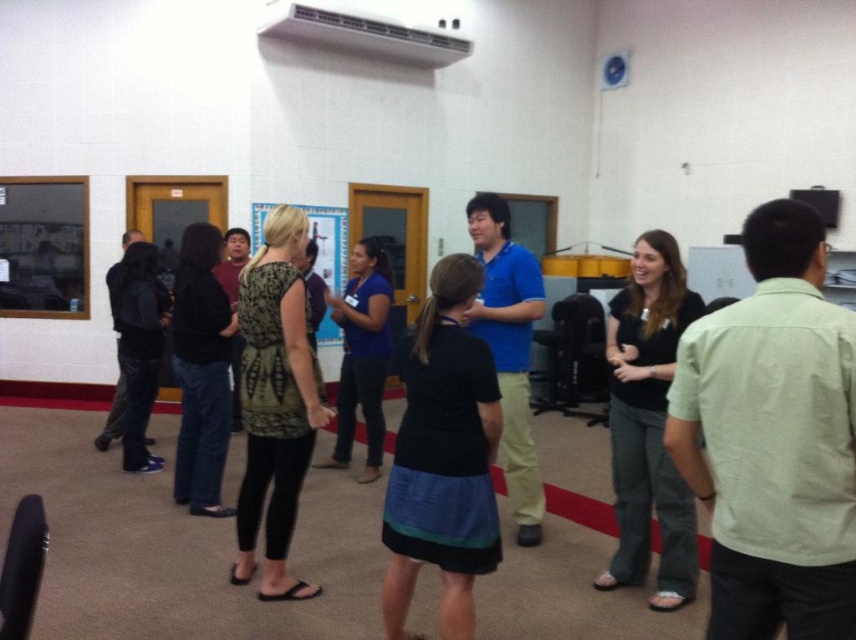
Does black matte pants at right appear over blue cotton shirt at center?

Incorrect, black matte pants at right is not positioned above blue cotton shirt at center.

How much distance is there between black matte pants at right and blue cotton shirt at center?

black matte pants at right is 22.36 inches away from blue cotton shirt at center.

Identify the location of black matte pants at right. Image resolution: width=856 pixels, height=640 pixels. (648, 422).

Describe the element at coordinates (773, 438) in the screenshot. I see `light green cotton shirt at center` at that location.

Locate an element on the screen. light green cotton shirt at center is located at coordinates (773, 438).

Between light green cotton shirt at center and blue cotton shirt at center, which one is positioned lower?

Positioned lower is light green cotton shirt at center.

Describe the element at coordinates (773, 438) in the screenshot. Image resolution: width=856 pixels, height=640 pixels. I see `light green cotton shirt at center` at that location.

Does point (703, 324) come behind point (526, 308)?

No, it is in front of (526, 308).

At what (x,y) coordinates should I click in order to perform the action: click on light green cotton shirt at center. Please return your answer as a coordinate pair (x, y). The height and width of the screenshot is (640, 856). Looking at the image, I should click on (773, 438).